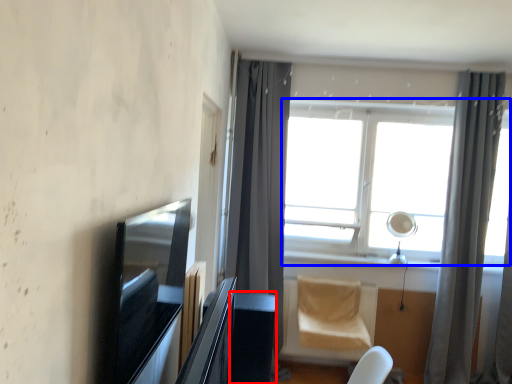
Question: Which object is further to the camera taking this photo, table (highlighted by a red box) or window (highlighted by a blue box)?

Choices:
 (A) table
 (B) window

Answer: (B)